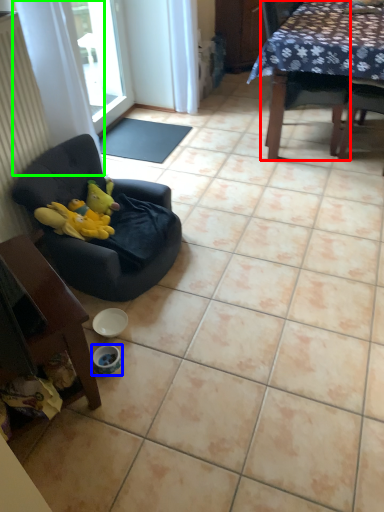
Question: Estimate the real-world distances between objects in this image. Which object is closer to chair (highlighted by a red box), bowl (highlighted by a blue box) or curtain (highlighted by a green box)?

Choices:
 (A) bowl
 (B) curtain

Answer: (B)